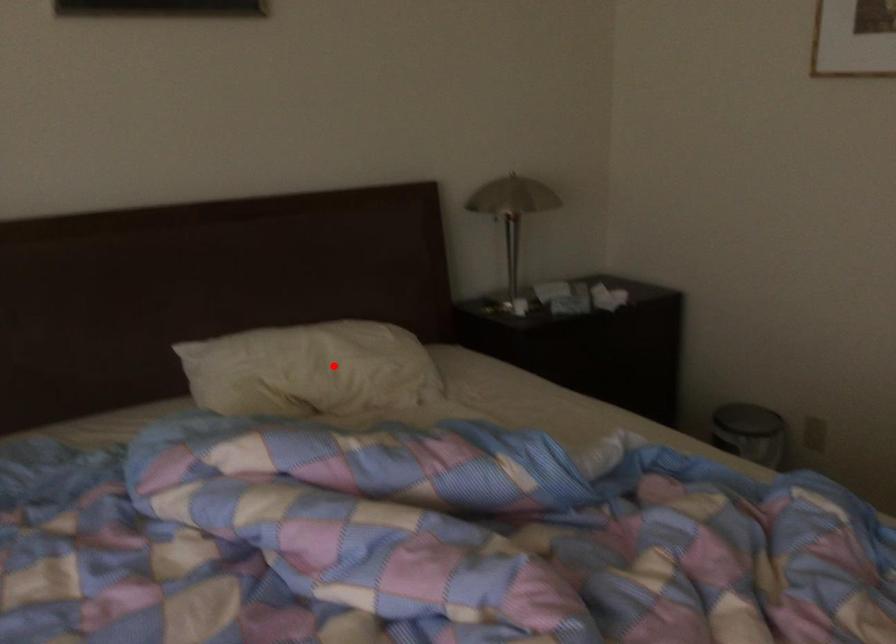
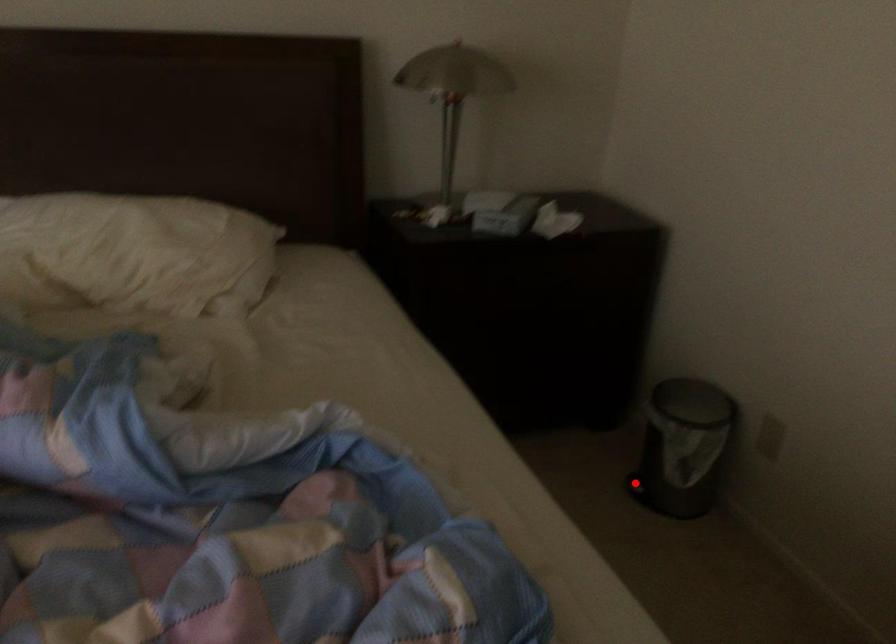
I am providing you with two images of the same scene from different viewpoints. A red point is marked on the first image and another point is marked on the second image. Do the highlighted points in image1 and image2 indicate the same real-world spot?

No